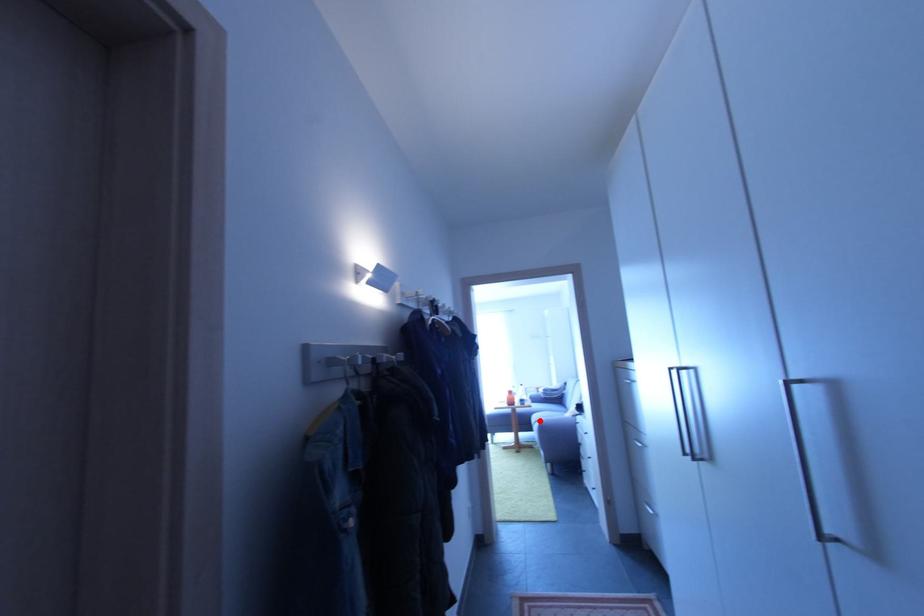
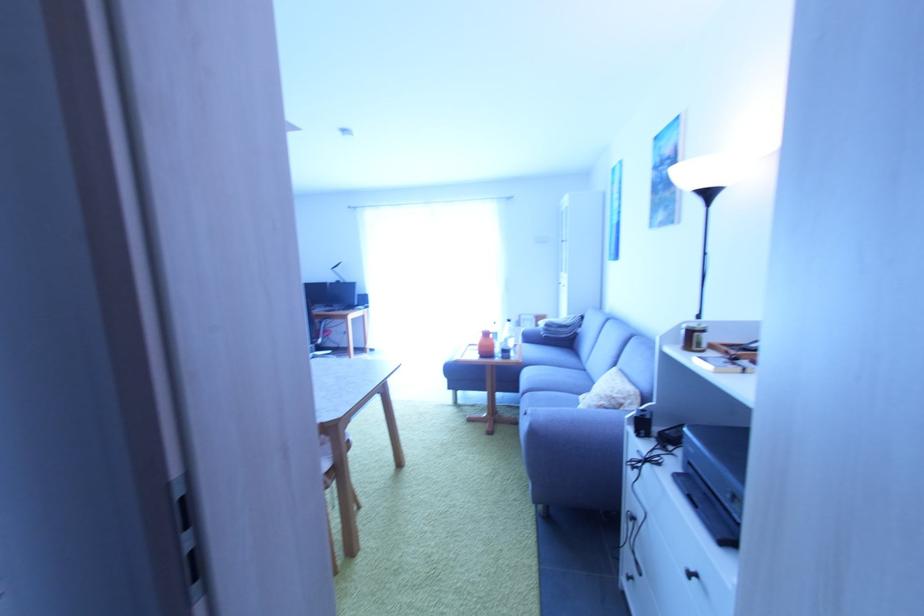
The point at the highlighted location is marked in the first image. Where is the corresponding point in the second image?

(530, 378)